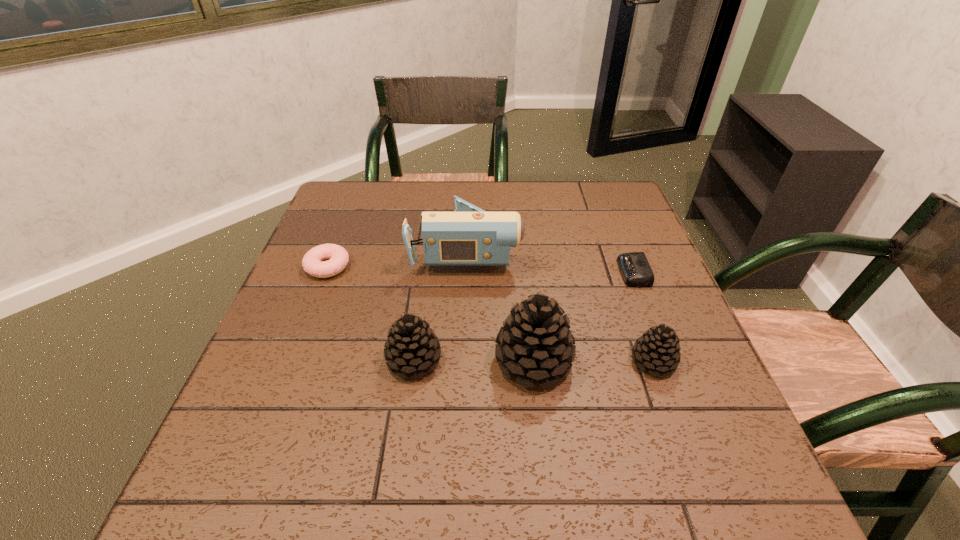
Observe the arrangement of all pinecones in the image. To keep them evenly spaced, where would you place another pinecone on the left? Please locate a free space. Please provide its 2D coordinates. Your answer should be formatted as a tuple, i.e. [(x, y)], where the tuple contains the x and y coordinates of a point satisfying the conditions above.

[(295, 359)]